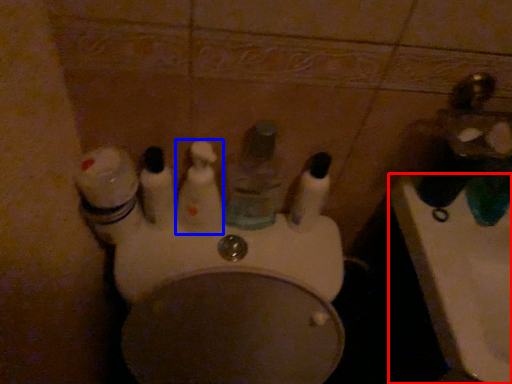
Question: Which object is further to the camera taking this photo, sink (highlighted by a red box) or mouthwash (highlighted by a blue box)?

Choices:
 (A) sink
 (B) mouthwash

Answer: (B)